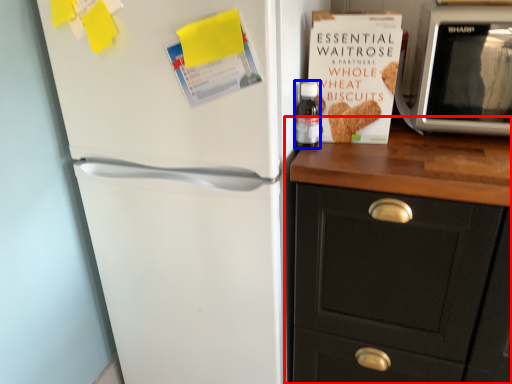
Question: Which object is further to the camera taking this photo, cabinetry (highlighted by a red box) or bottle (highlighted by a blue box)?

Choices:
 (A) cabinetry
 (B) bottle

Answer: (B)